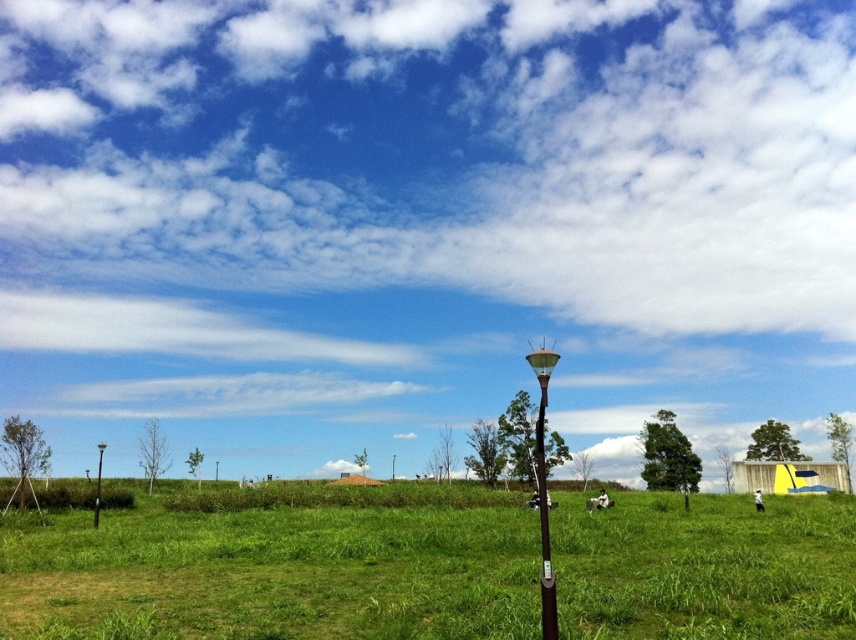
From the picture: You are standing at the origin point in the image and want to walk towards the point at the bottom right corner. Which of the two points, point (805,572) or point (545,550), will you encounter first?

Point (545,550) will be encountered first because it is closer to the origin point compared to point (805,572), which is positioned behind it.

You are a landscape architect designing a pathway through this area. You need to place a bench between the metallic gray pole at center and the metallic pole at left. Which pole should the bench be closer to if you want it to be near the pole that takes up more space?

The bench should be closer to the metallic pole at left because it occupies more space than the metallic gray pole at center.

You are standing at the origin point of the coordinate system in the image. You want to walk to the green grass at center. Which direction should you move in to reach it?

The green grass at center is located at coordinate point 0.897 on the x axis and 0.320 on the y axis. Since you are at the origin point, you should move towards the positive x and positive y direction to reach the green grass at center.